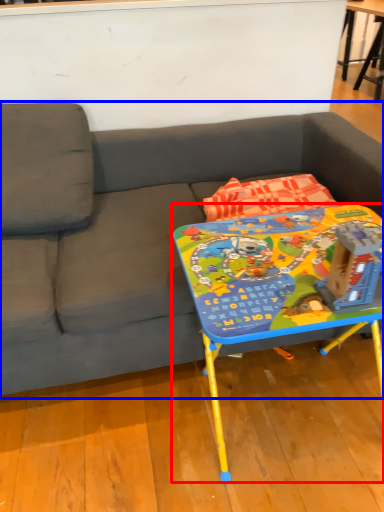
Question: Which object is further to the camera taking this photo, table (highlighted by a red box) or studio couch (highlighted by a blue box)?

Choices:
 (A) table
 (B) studio couch

Answer: (A)